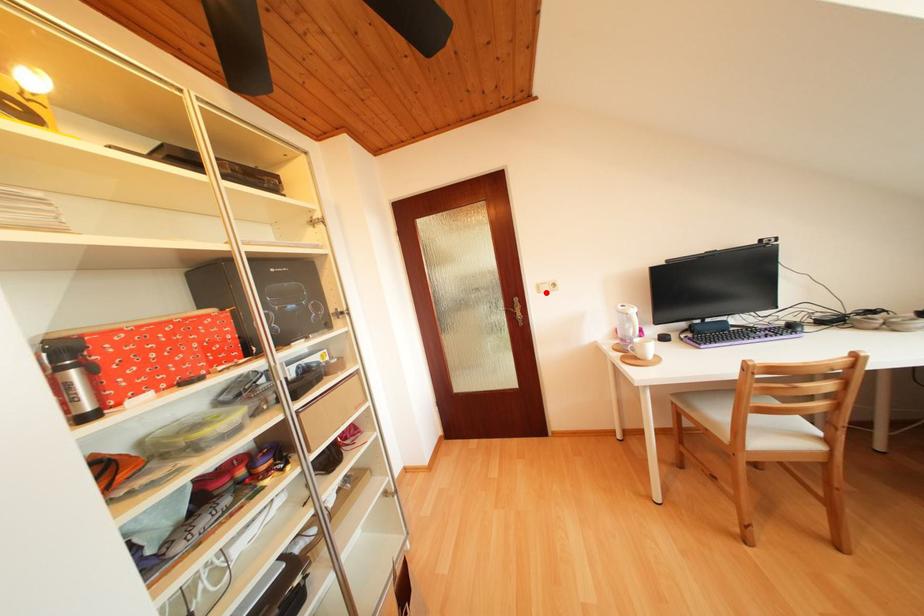
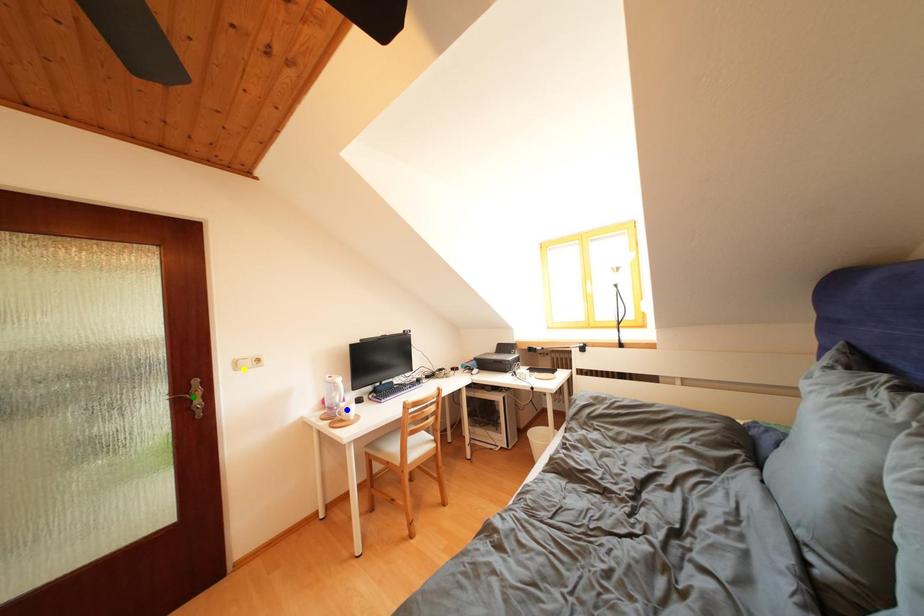
Question: I am providing you with two images of the same scene from different viewpoints. A red point is marked on the first image. You are given multiple points on the second image. Can you choose the point in image 2 that corresponds to the point in image 1?

Choices:
 (A) blue point
 (B) green point
 (C) yellow point

Answer: (C)